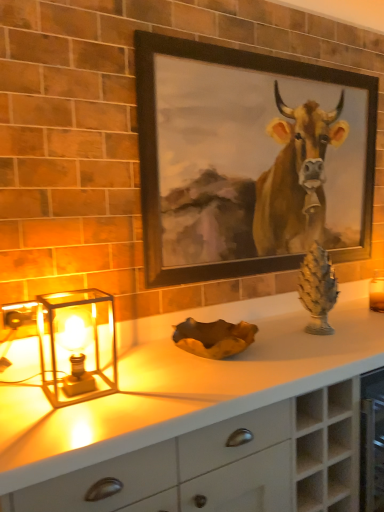
Question: Considering the positions of point (69, 401) and point (251, 495), is point (69, 401) closer or farther from the camera than point (251, 495)?

Choices:
 (A) farther
 (B) closer

Answer: (B)

Question: Which is correct: translucent glass table lamp at left is inside white matte countertop at center, or outside of it?

Choices:
 (A) outside
 (B) inside

Answer: (A)

Question: Which object is the closest to the green stone pine cone at right?

Choices:
 (A) translucent glass table lamp at left
 (B) black matte picture frame at upper center
 (C) white matte countertop at center

Answer: (B)

Question: Which object is positioned farthest from the black matte picture frame at upper center?

Choices:
 (A) white matte countertop at center
 (B) green stone pine cone at right
 (C) translucent glass table lamp at left

Answer: (A)